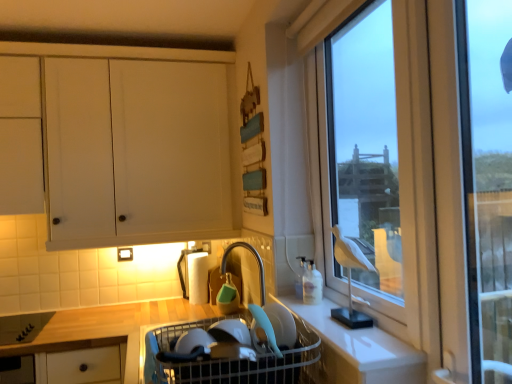
Question: Considering the relative sizes of white plastic sink at center and transparent glass window at right in the image provided, is white plastic sink at center wider than transparent glass window at right?

Choices:
 (A) yes
 (B) no

Answer: (A)

Question: Is white plastic sink at center bigger than transparent glass window at right?

Choices:
 (A) yes
 (B) no

Answer: (A)

Question: Can you confirm if white plastic sink at center is taller than transparent glass window at right?

Choices:
 (A) yes
 (B) no

Answer: (B)

Question: Considering the relative positions of white plastic sink at center and transparent glass window at right in the image provided, is white plastic sink at center behind transparent glass window at right?

Choices:
 (A) no
 (B) yes

Answer: (B)

Question: Is white plastic sink at center in contact with transparent glass window at right?

Choices:
 (A) no
 (B) yes

Answer: (A)

Question: Does point (267, 317) appear closer or farther from the camera than point (92, 130)?

Choices:
 (A) farther
 (B) closer

Answer: (B)

Question: Based on their sizes in the image, would you say matte plastic bowl at lower center is bigger or smaller than white matte cabinet at upper left?

Choices:
 (A) small
 (B) big

Answer: (A)

Question: Would you say matte plastic bowl at lower center is inside or outside white matte cabinet at upper left?

Choices:
 (A) outside
 (B) inside

Answer: (A)

Question: From a real-world perspective, is matte plastic bowl at lower center physically located above or below white matte cabinet at upper left?

Choices:
 (A) below
 (B) above

Answer: (A)

Question: Is white plastic sink at center inside the boundaries of white matte cabinet at upper left, or outside?

Choices:
 (A) inside
 (B) outside

Answer: (B)

Question: From a real-world perspective, relative to white matte cabinet at upper left, is white plastic sink at center vertically above or below?

Choices:
 (A) below
 (B) above

Answer: (A)

Question: Considering their positions, is white plastic sink at center located in front of or behind white matte cabinet at upper left?

Choices:
 (A) behind
 (B) front

Answer: (B)

Question: From the image's perspective, is white plastic sink at center positioned above or below white matte cabinet at upper left?

Choices:
 (A) above
 (B) below

Answer: (B)

Question: Is point (335, 357) positioned closer to the camera than point (431, 44)?

Choices:
 (A) closer
 (B) farther

Answer: (B)

Question: Relative to transparent glass window at right, is white matte counter at lower right in front or behind?

Choices:
 (A) front
 (B) behind

Answer: (A)